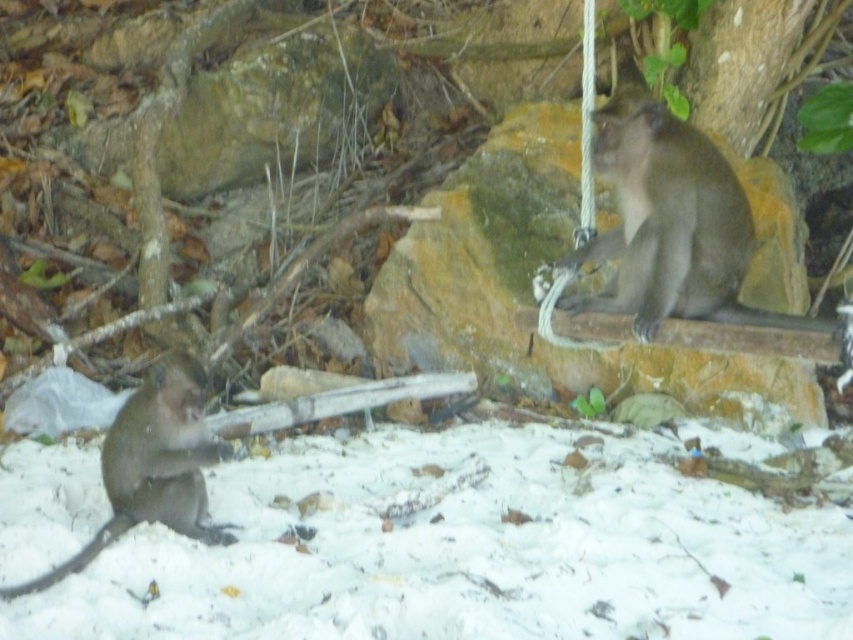
Based on the photo, you are standing at the point marked as point [793,324] in the image. You want to throw a banana to the monkey sitting on the sand facing away from you. Can you reach the monkey with your throw? The monkey is 2.5 meters away from you.

The point [793,324] is 3.42 meters away from the viewer. Since the monkey is 2.5 meters away from you, you can reach the monkey with your throw as 2.5 meters is within the 3.42 meters distance.

You are a photographer trying to capture both monkeys in a single frame. The monkey on the smooth brown rock at upper right is 5.23 meters away from the monkey sitting on the sand. If your camera has a focal length of 50mm, which is ideal for portraits, will you need to adjust the focal length to include both monkeys in the frame?

Since the two monkeys are 5.23 meters apart, adjusting the focal length to a wider angle would be necessary to capture both in the frame. A 50mm lens might be too narrow to include both subjects at that distance, so switching to a shorter focal length like 35mm or 24mm would help ensure both monkeys are visible in the photo.